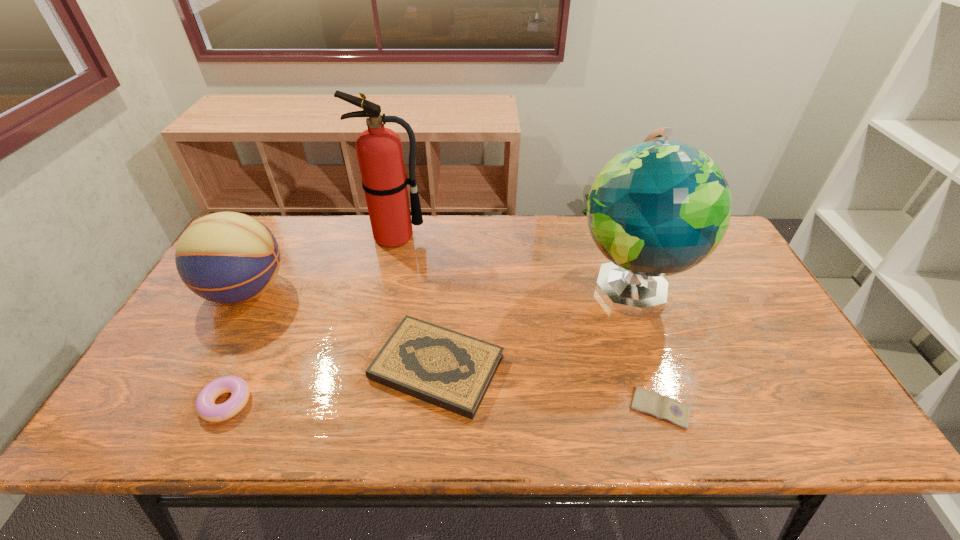
Choose which object is the third nearest neighbor to the globe. Please provide its 2D coordinates. Your answer should be formatted as a tuple, i.e. [(x, y)], where the tuple contains the x and y coordinates of a point satisfying the conditions above.

[(379, 150)]

Identify the location of free space that satisfies the following two spatial constraints: 1. at the nozzle of the fire extinguisher; 2. on the patterned surface of the third tallest object. [x=383, y=291].

In order to click on vacant area in the image that satisfies the following two spatial constraints: 1. on the front surface of the globe; 2. on the patterned surface of the fourth shortest object in this screenshot , I will do `click(631, 291)`.

You are a GUI agent. You are given a task and a screenshot of the screen. Output one action in this format:
    pyautogui.click(x=<x>, y=<y>)
    Task: Click on the free space in the image that satisfies the following two spatial constraints: 1. at the nozzle of the fire extinguisher; 2. on the right side of the diary
    Image resolution: width=960 pixels, height=540 pixels.
    Given the screenshot: What is the action you would take?
    pyautogui.click(x=356, y=408)

The width and height of the screenshot is (960, 540). In order to click on free space that satisfies the following two spatial constraints: 1. at the nozzle of the fire extinguisher; 2. on the patterned surface of the basketball in this screenshot , I will do tap(383, 291).

In order to click on vacant space that satisfies the following two spatial constraints: 1. on the patterned surface of the fourth shortest object; 2. on the right side of the doughnut in this screenshot , I will do `click(185, 403)`.